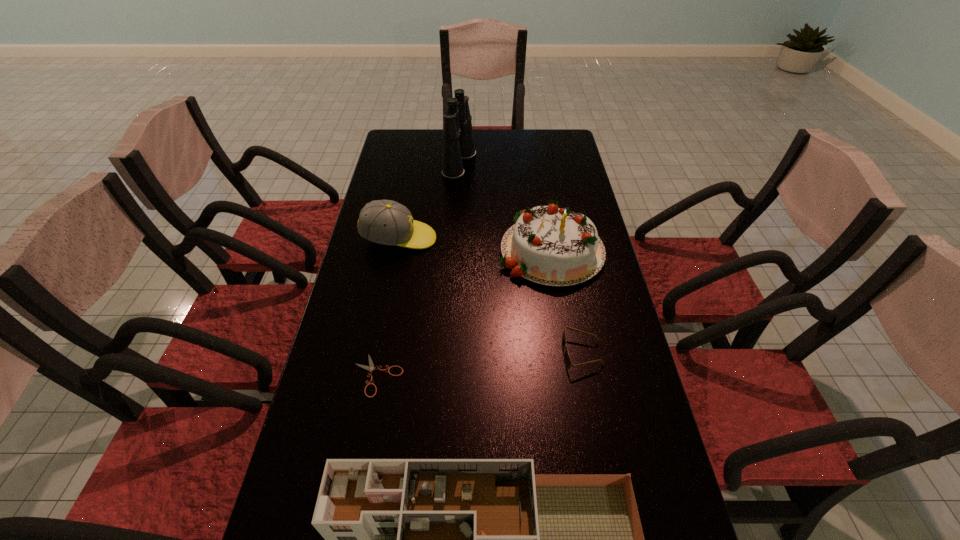
Locate an element on the screen. This screenshot has height=540, width=960. free space at the right edge is located at coordinates (608, 299).

Where is `free point at the far right corner`? The width and height of the screenshot is (960, 540). free point at the far right corner is located at coordinates pyautogui.click(x=540, y=140).

Identify the location of empty location between the fifth tallest object and the shortest object. pyautogui.click(x=480, y=364).

Where is `unoccupied position between the baseball cap and the tallest object`? The width and height of the screenshot is (960, 540). unoccupied position between the baseball cap and the tallest object is located at coordinates (429, 201).

Locate an element on the screen. The image size is (960, 540). free space between the second tallest object and the shears is located at coordinates (465, 312).

Image resolution: width=960 pixels, height=540 pixels. Find the location of `vacant space that is in between the baseball cap and the second tallest object`. vacant space that is in between the baseball cap and the second tallest object is located at coordinates (475, 244).

What are the coordinates of `free space that is in between the baseball cap and the second tallest object` in the screenshot? It's located at (475, 244).

At what (x,y) coordinates should I click in order to perform the action: click on free space between the baseball cap and the sunglasses. Please return your answer as a coordinate pair (x, y). The height and width of the screenshot is (540, 960). Looking at the image, I should click on (491, 296).

Choose which object is the second nearest neighbor to the second tallest object. Please provide its 2D coordinates. Your answer should be formatted as a tuple, i.e. [(x, y)], where the tuple contains the x and y coordinates of a point satisfying the conditions above.

[(386, 222)]

You are a GUI agent. You are given a task and a screenshot of the screen. Output one action in this format:
    pyautogui.click(x=<x>, y=<y>)
    Task: Click on the object that is the second closest to the dollhouse
    The height and width of the screenshot is (540, 960).
    Given the screenshot: What is the action you would take?
    pyautogui.click(x=567, y=360)